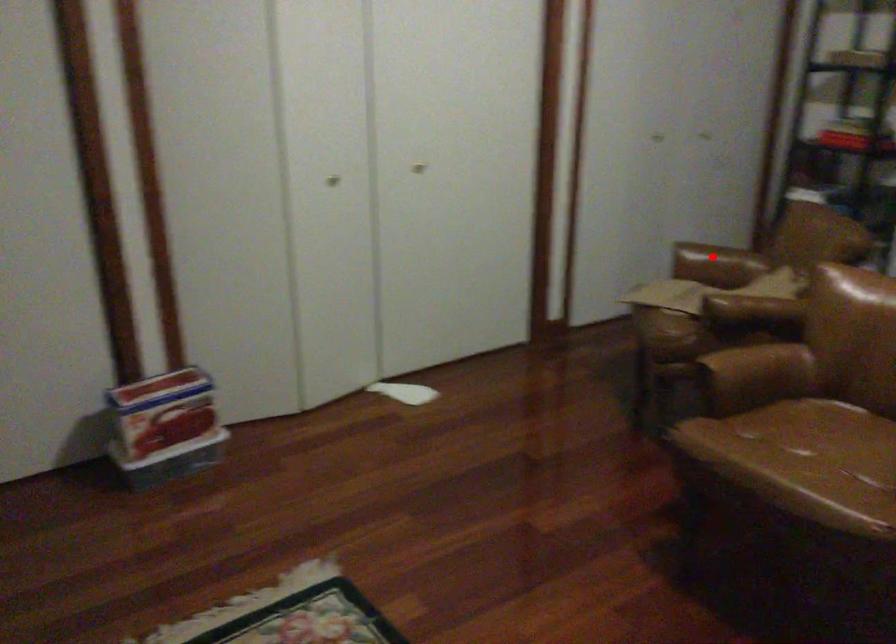
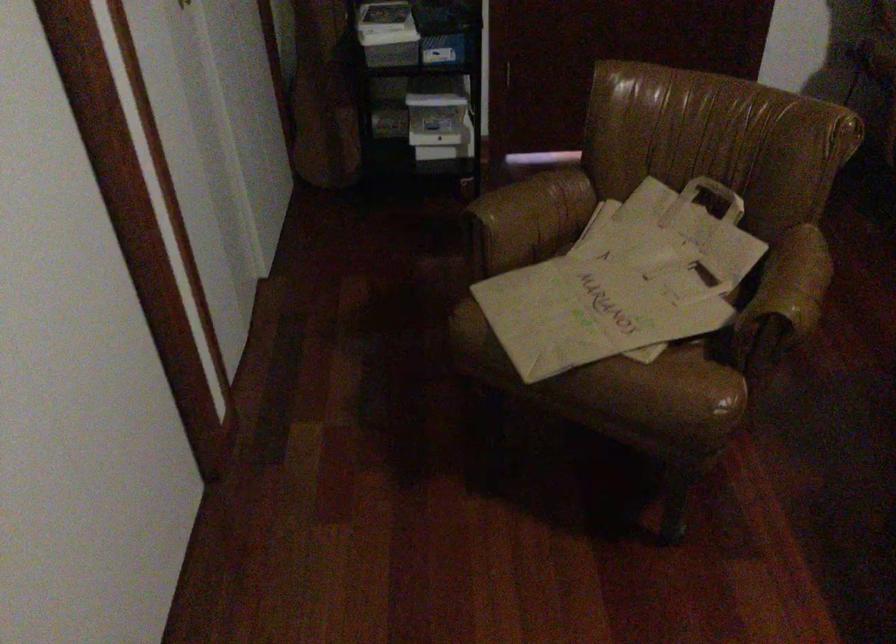
Where in the second image is the point corresponding to the highlighted location from the first image?

(532, 216)